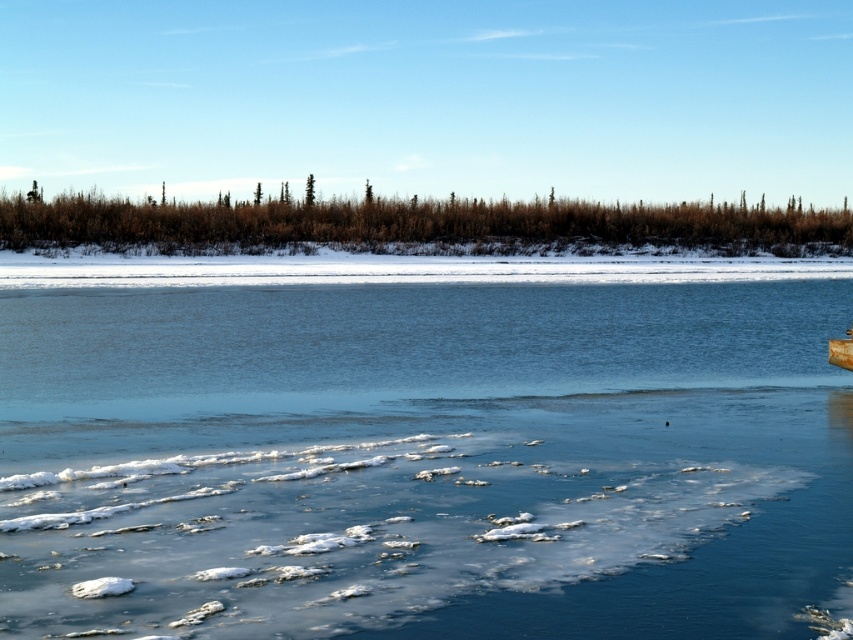
Question: Which object appears farthest from the camera in this image?

Choices:
 (A) wooden canoe at lower right
 (B) translucent ice at center

Answer: (A)

Question: Which of the following is the farthest from the observer?

Choices:
 (A) translucent ice at center
 (B) wooden canoe at lower right

Answer: (B)

Question: Is translucent ice at center positioned behind wooden canoe at lower right?

Choices:
 (A) yes
 (B) no

Answer: (B)

Question: Which point is closer to the camera?

Choices:
 (A) (403, 540)
 (B) (848, 365)

Answer: (A)

Question: Is translucent ice at center to the right of wooden canoe at lower right from the viewer's perspective?

Choices:
 (A) no
 (B) yes

Answer: (A)

Question: Is the position of translucent ice at center more distant than that of wooden canoe at lower right?

Choices:
 (A) no
 (B) yes

Answer: (A)